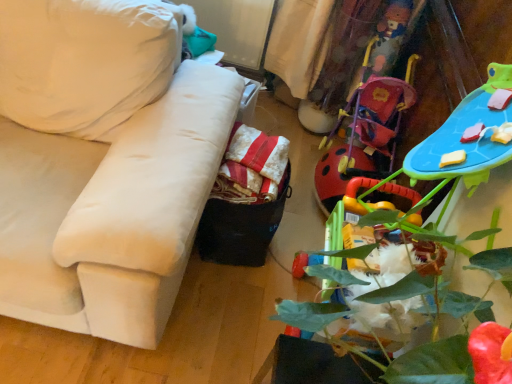
What do you see at coordinates (112, 211) in the screenshot? I see `velvet white couch at left` at bounding box center [112, 211].

What is the approximate width of green leafy plant at lower right?

green leafy plant at lower right is 19.40 inches wide.

At what (x,y) coordinates should I click in order to perform the action: click on green leafy plant at lower right. Please return your answer as a coordinate pair (x, y). This screenshot has height=384, width=512. Looking at the image, I should click on (407, 327).

The width and height of the screenshot is (512, 384). What are the coordinates of `velvet white couch at left` in the screenshot? It's located at (112, 211).

Between velvet white couch at left and green leafy plant at lower right, which one has larger width?

velvet white couch at left is wider.

Relative to green leafy plant at lower right, is velvet white couch at left in front or behind?

Visually, velvet white couch at left is located in front of green leafy plant at lower right.

Is velvet white couch at left positioned far away from green leafy plant at lower right?

No, velvet white couch at left is not far from green leafy plant at lower right.

Is velvet white couch at left smaller than green leafy plant at lower right?

Incorrect, velvet white couch at left is not smaller in size than green leafy plant at lower right.

Considering the sizes of objects red striped fabric at center and green leafy plant at lower right in the image provided, who is bigger, red striped fabric at center or green leafy plant at lower right?

With larger size is green leafy plant at lower right.

Which object is positioned more to the left, red striped fabric at center or green leafy plant at lower right?

Positioned to the left is red striped fabric at center.

Between red striped fabric at center and green leafy plant at lower right, which one is positioned behind?

red striped fabric at center is more distant.

From a real-world perspective, is red striped fabric at center above or below green leafy plant at lower right?

red striped fabric at center is below green leafy plant at lower right.

From the image's perspective, which object appears higher, velvet white couch at left or red striped fabric at center?

From the image's view, velvet white couch at left is above.

In terms of width, does velvet white couch at left look wider or thinner when compared to red striped fabric at center?

Considering their sizes, velvet white couch at left looks broader than red striped fabric at center.

You are a GUI agent. You are given a task and a screenshot of the screen. Output one action in this format:
    pyautogui.click(x=<x>, y=<y>)
    Task: Click on the studio couch above the red striped fabric at center (from the image's perspective)
    
    Given the screenshot: What is the action you would take?
    pyautogui.click(x=112, y=211)

How different are the orientations of velvet white couch at left and red striped fabric at center in degrees?

0.899 degrees.

Which is in front, point (323, 321) or point (278, 193)?

The point (323, 321) is closer.

Is green leafy plant at lower right thinner than red striped fabric at center?

No.

Is green leafy plant at lower right with red striped fabric at center?

No, green leafy plant at lower right is not touching red striped fabric at center.

Is green leafy plant at lower right positioned with its back to red striped fabric at center?

No, red striped fabric at center is not at the back of green leafy plant at lower right.

Between red striped fabric at center and velvet white couch at left, which one has less height?

red striped fabric at center is shorter.

Which is correct: red striped fabric at center is inside velvet white couch at left, or outside of it?

red striped fabric at center is outside velvet white couch at left.

Considering the relative positions of red striped fabric at center and velvet white couch at left in the image provided, is red striped fabric at center to the left or to the right of velvet white couch at left?

Based on their positions, red striped fabric at center is located to the right of velvet white couch at left.

Find the location of a particular element. This screenshot has width=512, height=384. studio couch in front of the red striped fabric at center is located at coordinates (112, 211).

Is green leafy plant at lower right beside velvet white couch at left?

No, green leafy plant at lower right is not making contact with velvet white couch at left.

Where is `studio couch in front of the green leafy plant at lower right`? This screenshot has width=512, height=384. studio couch in front of the green leafy plant at lower right is located at coordinates (112, 211).

Is green leafy plant at lower right located outside velvet white couch at left?

That's correct, green leafy plant at lower right is outside of velvet white couch at left.

Find the location of a particular element. This screenshot has width=512, height=384. plant that appears on the right of velvet white couch at left is located at coordinates (407, 327).

The image size is (512, 384). Identify the location of plant lying below the red striped fabric at center (from the image's perspective). (407, 327).

Considering their positions, is red striped fabric at center positioned further to green leafy plant at lower right than velvet white couch at left?

Among the two, velvet white couch at left is located further to green leafy plant at lower right.

From the image, which object appears to be farther from red striped fabric at center, green leafy plant at lower right or velvet white couch at left?

The object further to red striped fabric at center is green leafy plant at lower right.

Based on the photo, when comparing their distances from velvet white couch at left, does green leafy plant at lower right or red striped fabric at center seem closer?

red striped fabric at center is closer to velvet white couch at left.

When comparing their distances from green leafy plant at lower right, does velvet white couch at left or red striped fabric at center seem closer?

red striped fabric at center is positioned closer to the anchor green leafy plant at lower right.

Estimate the real-world distances between objects in this image. Which object is closer to velvet white couch at left, red striped fabric at center or green leafy plant at lower right?

The object closer to velvet white couch at left is red striped fabric at center.

Which object lies further to the anchor point red striped fabric at center, velvet white couch at left or green leafy plant at lower right?

Among the two, green leafy plant at lower right is located further to red striped fabric at center.

This screenshot has width=512, height=384. Identify the location of material situated between velvet white couch at left and green leafy plant at lower right from left to right. (252, 167).